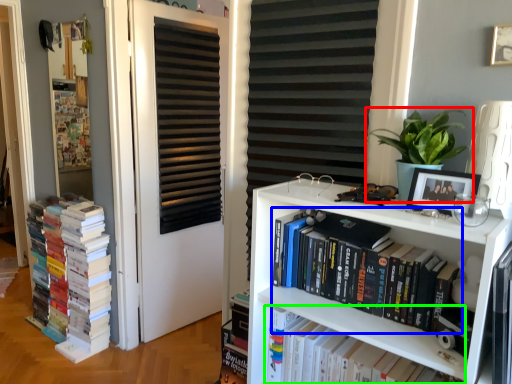
Question: Estimate the real-world distances between objects in this image. Which object is closer to houseplant (highlighted by a red box), book (highlighted by a blue box) or book (highlighted by a green box)?

Choices:
 (A) book
 (B) book

Answer: (A)